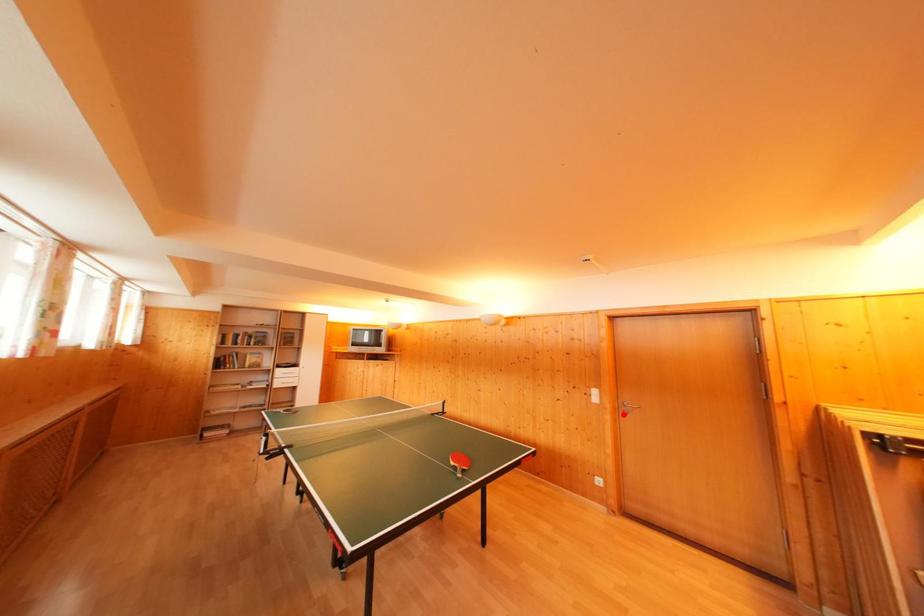
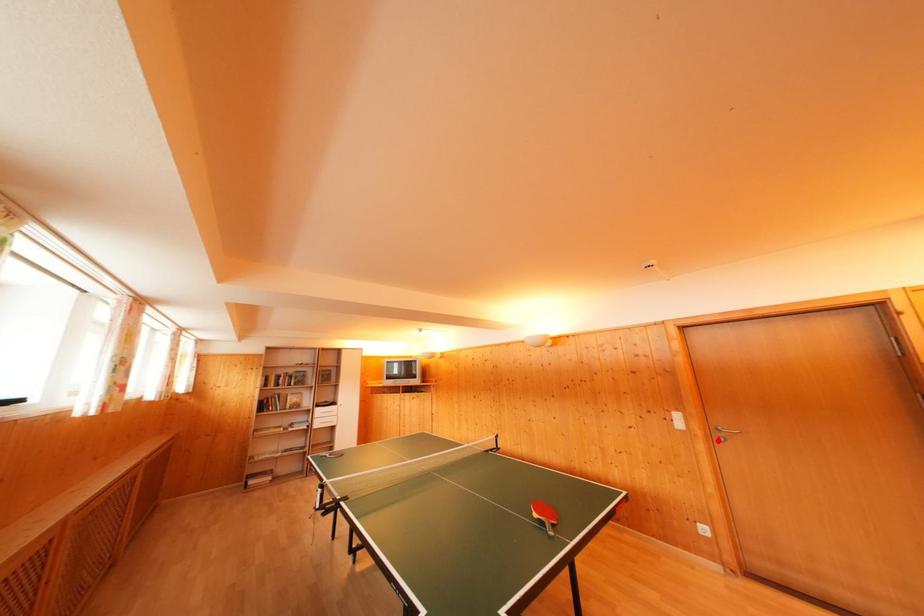
I am providing you with two images of the same scene from different viewpoints. A red point is marked on the first image and another point is marked on the second image. Is the marked point in image1 the same physical position as the marked point in image2?

Yes